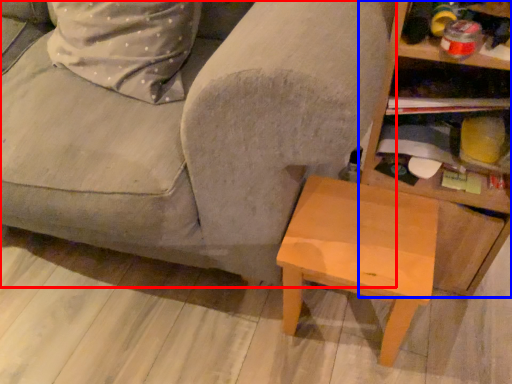
Question: Which object is further to the camera taking this photo, studio couch (highlighted by a red box) or shelf (highlighted by a blue box)?

Choices:
 (A) studio couch
 (B) shelf

Answer: (B)